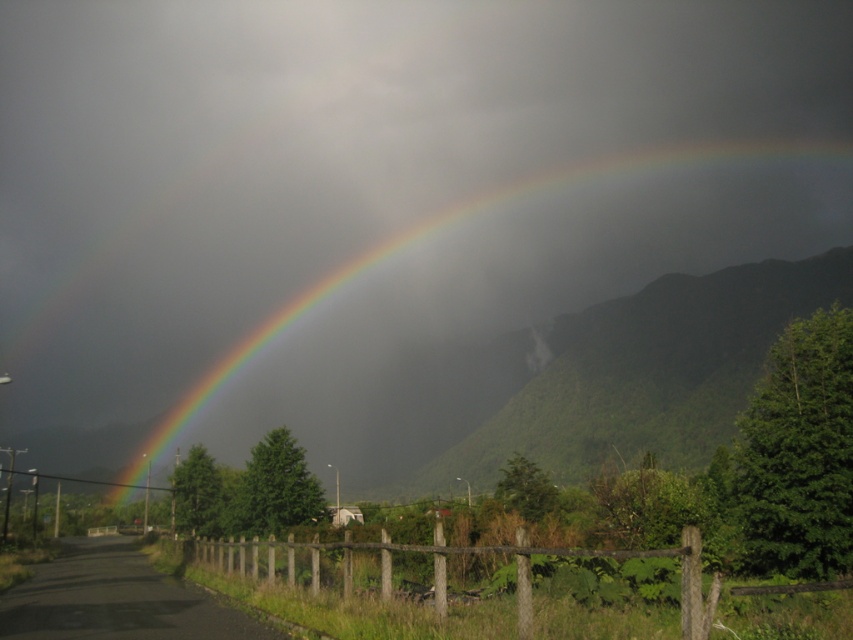
You are standing at the point closest to you in the image. There are two points marked in the scene, one at coordinates point (404, 403) and the other at point (753, 333). Which point are you currently standing at?

You are standing at point (753, 333) because it is closer to you than point (404, 403), which is behind it.

You are standing on the road and see the green leafy mountain at center and the brown wooden fence at lower center. Which object is positioned to the right side from your viewpoint?

The green leafy mountain at center is to the right of the brown wooden fence at lower center, so the green leafy mountain at center is positioned to the right side from your viewpoint.

From the picture: You are a photographer trying to capture the rainbow at upper center and the green leafy mountain at center in a single frame. Based on their sizes, which object would appear more prominent in the photo?

The rainbow at upper center is larger in size than the green leafy mountain at center, so it would appear more prominent in the photo.